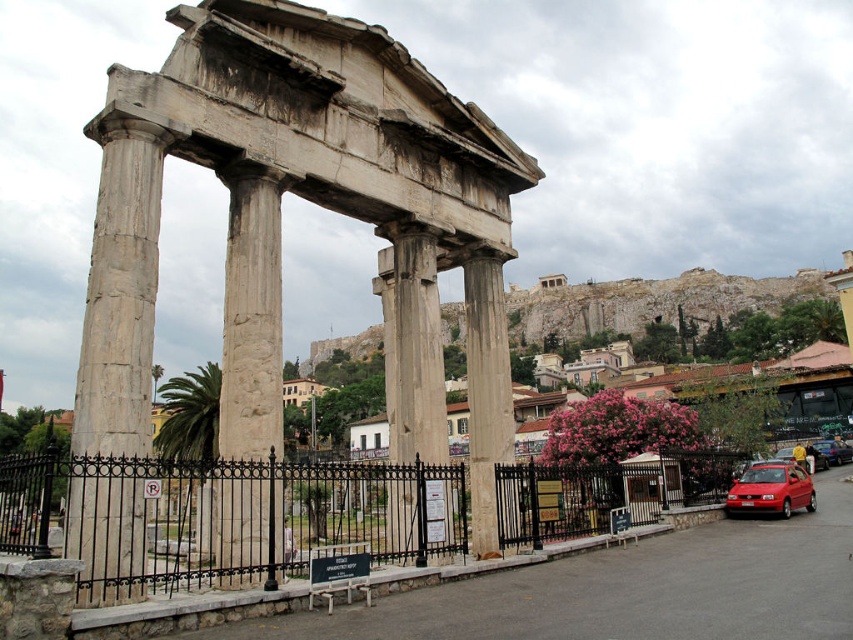
Is white stone columns at center smaller than marble column at center?

Incorrect, white stone columns at center is not smaller in size than marble column at center.

Image resolution: width=853 pixels, height=640 pixels. Describe the element at coordinates (280, 220) in the screenshot. I see `white stone columns at center` at that location.

Is point (436, 291) in front of point (496, 301)?

Yes, it is.

I want to click on white stone columns at center, so click(280, 220).

Which of these two, gray stone column at center or marble column at center, stands taller?

Standing taller between the two is marble column at center.

Based on the photo, is the position of gray stone column at center less distant than that of marble column at center?

Yes.

Locate an element on the screen. gray stone column at center is located at coordinates (412, 344).

Can you confirm if white marble column at left is positioned to the right of marble column at center?

In fact, white marble column at left is to the left of marble column at center.

Does white marble column at left have a greater width compared to marble column at center?

Indeed, white marble column at left has a greater width compared to marble column at center.

Identify the location of white marble column at left. This screenshot has width=853, height=640. (115, 368).